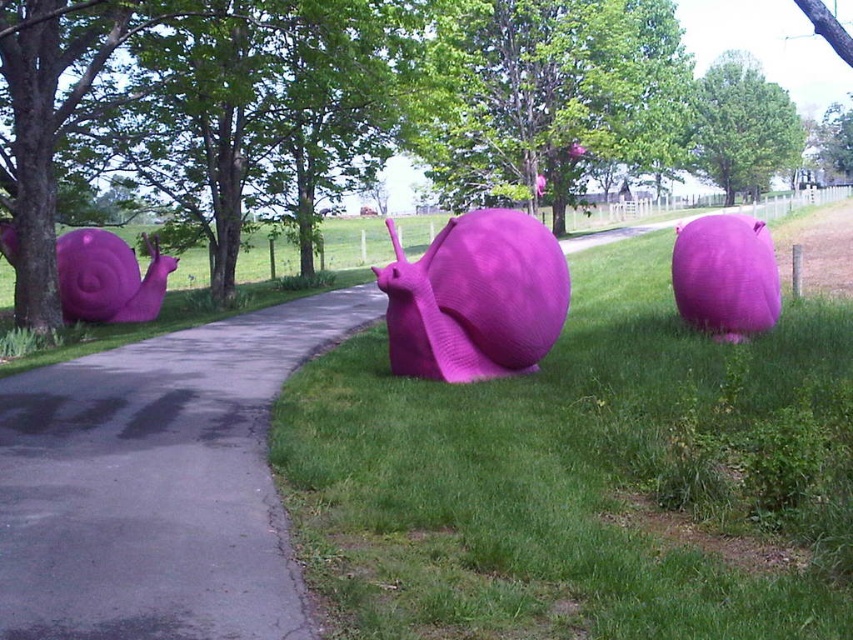
Question: Which point appears closest to the camera in this image?

Choices:
 (A) (341, 385)
 (B) (468, 372)

Answer: (A)

Question: Is asphalt at center closer to camera compared to matte plastic snail at center?

Choices:
 (A) no
 (B) yes

Answer: (B)

Question: Which point is closer to the camera taking this photo?

Choices:
 (A) (125, 317)
 (B) (241, 426)
 (C) (518, 292)

Answer: (B)

Question: Which object is the closest to the matte plastic snail at center?

Choices:
 (A) matte pink snail at right
 (B) matte plastic snail at left

Answer: (A)

Question: Is matte plastic snail at center closer to the viewer compared to matte pink snail at right?

Choices:
 (A) no
 (B) yes

Answer: (B)

Question: Observing the image, what is the correct spatial positioning of matte plastic snail at center in reference to matte plastic snail at left?

Choices:
 (A) right
 (B) left

Answer: (A)